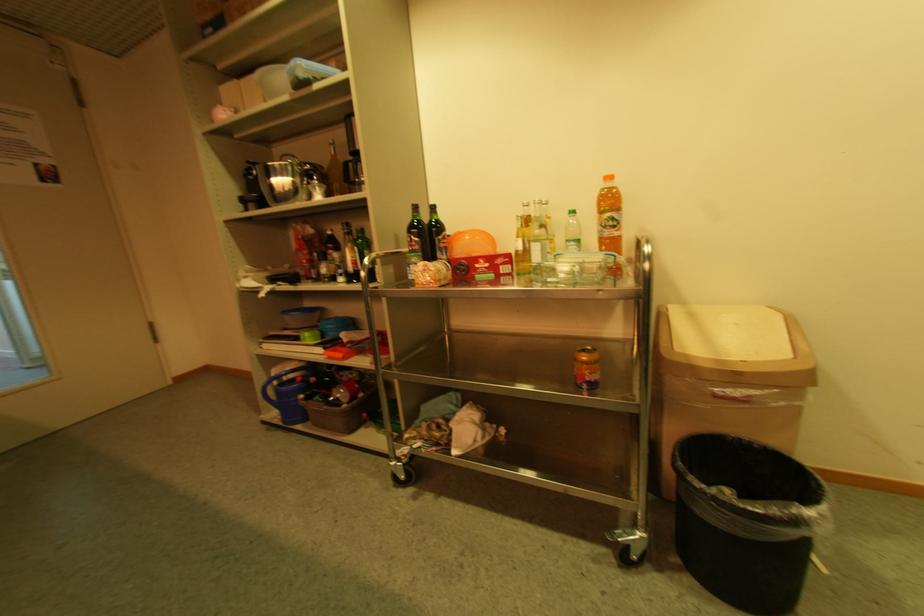
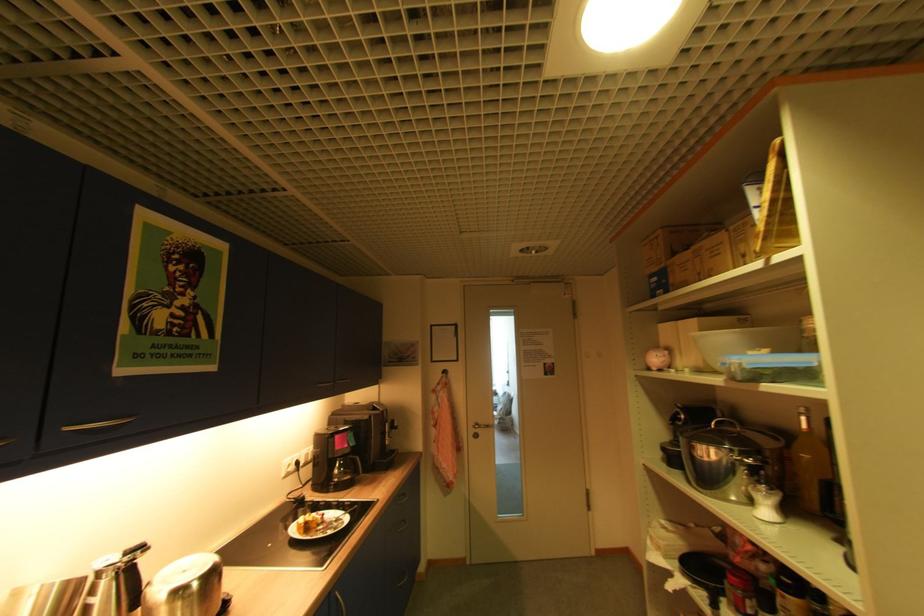
Find the pixel in the second image that matches [338,154] in the first image.

(809, 428)